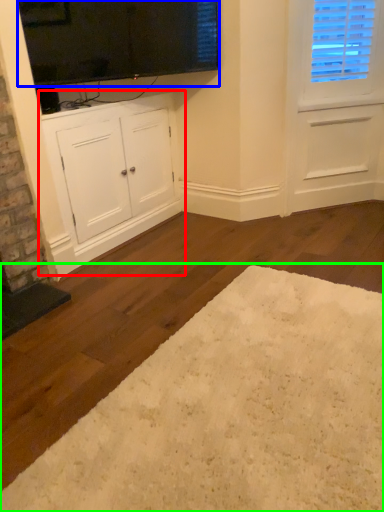
Question: Which is nearer to the cabinetry (highlighted by a red box)? window screen (highlighted by a blue box) or plain (highlighted by a green box).

Choices:
 (A) window screen
 (B) plain

Answer: (A)